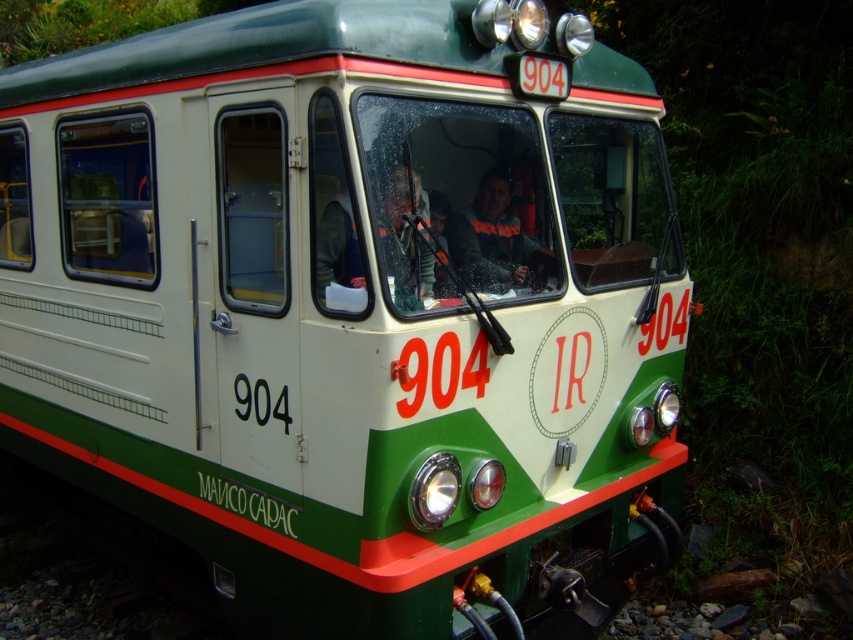
Can you confirm if matte black jacket at center is thinner than dark gray fabric jacket at center?

Correct, matte black jacket at center's width is less than dark gray fabric jacket at center's.

This screenshot has width=853, height=640. Identify the location of matte black jacket at center. [405, 241].

This screenshot has height=640, width=853. I want to click on matte black jacket at center, so click(x=405, y=241).